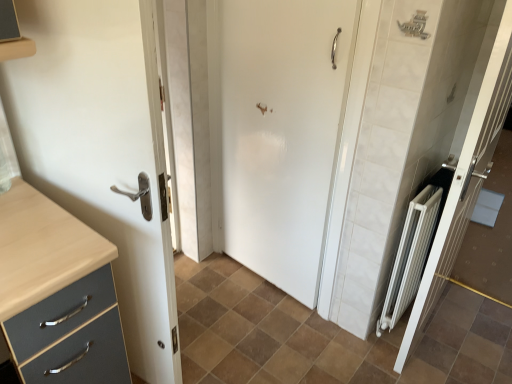
Identify the location of free space between white matte door at center, arranged as the 2th door when viewed from the left, and white glossy door at left, which appears as the third door when viewed from the right. Image resolution: width=512 pixels, height=384 pixels. (224, 315).